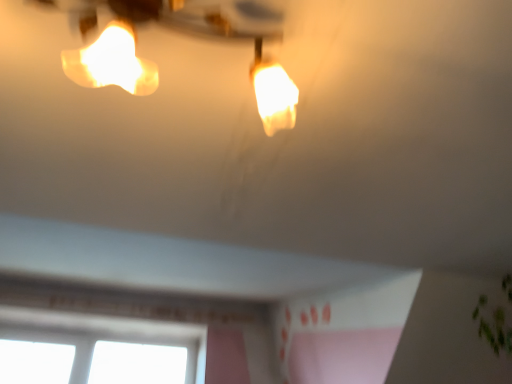
Question: Is transparent glass window at lower left taller or shorter than matte white lamp at upper center?

Choices:
 (A) short
 (B) tall

Answer: (B)

Question: Is point [131, 319] closer or farther from the camera than point [266, 62]?

Choices:
 (A) farther
 (B) closer

Answer: (A)

Question: Considering the relative positions of transparent glass window at lower left and matte white lamp at upper center in the image provided, is transparent glass window at lower left to the left or to the right of matte white lamp at upper center?

Choices:
 (A) right
 (B) left

Answer: (B)

Question: Considering the positions of matte white lamp at upper center and transparent glass window at lower left in the image, is matte white lamp at upper center taller or shorter than transparent glass window at lower left?

Choices:
 (A) tall
 (B) short

Answer: (B)

Question: Is matte white lamp at upper center inside the boundaries of transparent glass window at lower left, or outside?

Choices:
 (A) inside
 (B) outside

Answer: (B)

Question: From the image's perspective, is matte white lamp at upper center located above or below transparent glass window at lower left?

Choices:
 (A) above
 (B) below

Answer: (A)

Question: From a real-world perspective, is matte white lamp at upper center positioned above or below transparent glass window at lower left?

Choices:
 (A) above
 (B) below

Answer: (B)